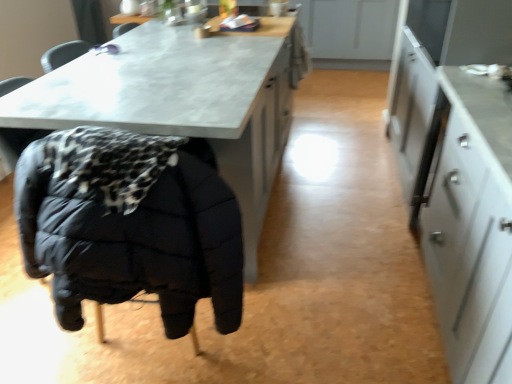
Question: From the image's perspective, is black quilted jacket at lower left above white glossy cabinet at right?

Choices:
 (A) no
 (B) yes

Answer: (B)

Question: Considering the relative sizes of black quilted jacket at lower left and white glossy cabinet at right in the image provided, is black quilted jacket at lower left thinner than white glossy cabinet at right?

Choices:
 (A) yes
 (B) no

Answer: (B)

Question: Is black quilted jacket at lower left not close to white glossy cabinet at right?

Choices:
 (A) yes
 (B) no

Answer: (A)

Question: Can you confirm if black quilted jacket at lower left is positioned to the right of white glossy cabinet at right?

Choices:
 (A) no
 (B) yes

Answer: (A)

Question: Is black quilted jacket at lower left outside of white glossy cabinet at right?

Choices:
 (A) no
 (B) yes

Answer: (B)

Question: Does black quilted jacket at lower left contain white glossy cabinet at right?

Choices:
 (A) yes
 (B) no

Answer: (B)

Question: Considering the relative positions of black quilted jacket at lower left and matte gray table at center in the image provided, is black quilted jacket at lower left behind matte gray table at center?

Choices:
 (A) no
 (B) yes

Answer: (A)

Question: Can you confirm if black quilted jacket at lower left is thinner than matte gray table at center?

Choices:
 (A) no
 (B) yes

Answer: (B)

Question: Is black quilted jacket at lower left to the left of matte gray table at center from the viewer's perspective?

Choices:
 (A) yes
 (B) no

Answer: (A)

Question: Is black quilted jacket at lower left taller than matte gray table at center?

Choices:
 (A) no
 (B) yes

Answer: (A)

Question: Is black quilted jacket at lower left in contact with matte gray table at center?

Choices:
 (A) yes
 (B) no

Answer: (B)

Question: From a real-world perspective, does black quilted jacket at lower left sit lower than matte gray table at center?

Choices:
 (A) yes
 (B) no

Answer: (B)

Question: From a real-world perspective, does white glossy cabinet at right sit lower than matte gray table at center?

Choices:
 (A) no
 (B) yes

Answer: (B)